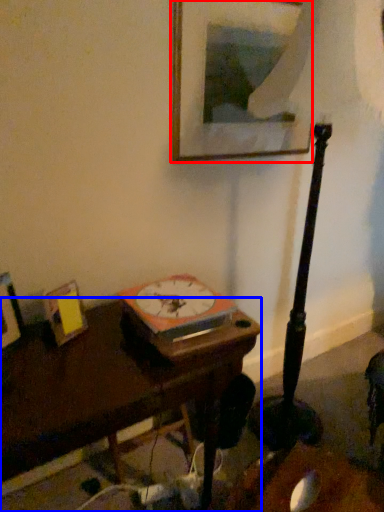
Question: Which point is further to the camera, picture frame (highlighted by a red box) or table (highlighted by a blue box)?

Choices:
 (A) picture frame
 (B) table

Answer: (A)